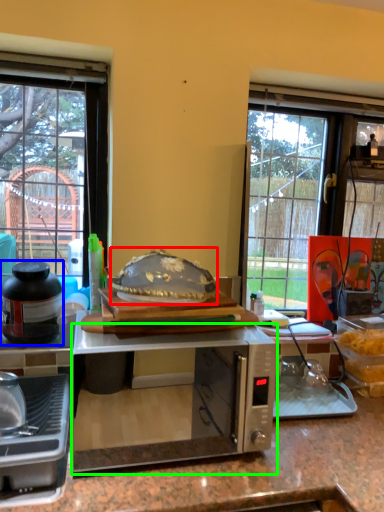
Question: Considering the real-world distances, which object is farthest from food (highlighted by a red box)? kitchen appliance (highlighted by a blue box) or microwave oven (highlighted by a green box)?

Choices:
 (A) kitchen appliance
 (B) microwave oven

Answer: (B)